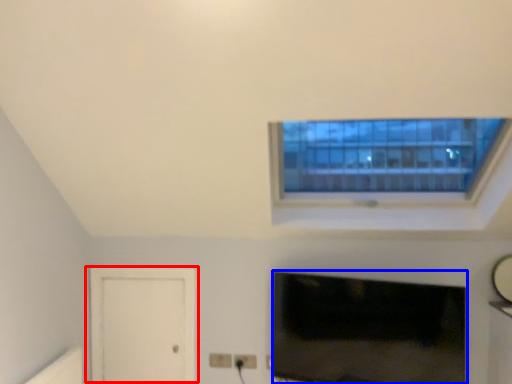
Question: Which point is further to the camera, door (highlighted by a red box) or television (highlighted by a blue box)?

Choices:
 (A) door
 (B) television

Answer: (A)